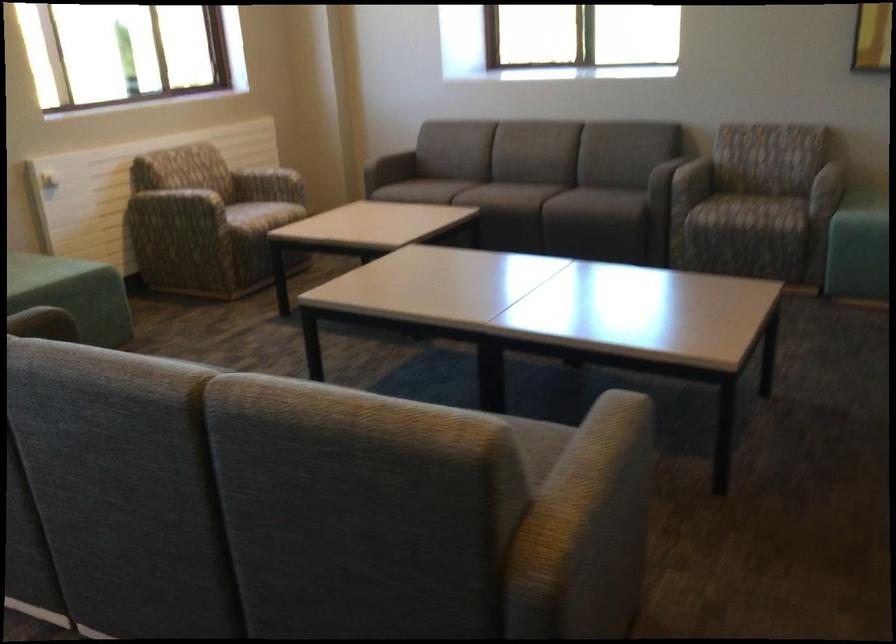
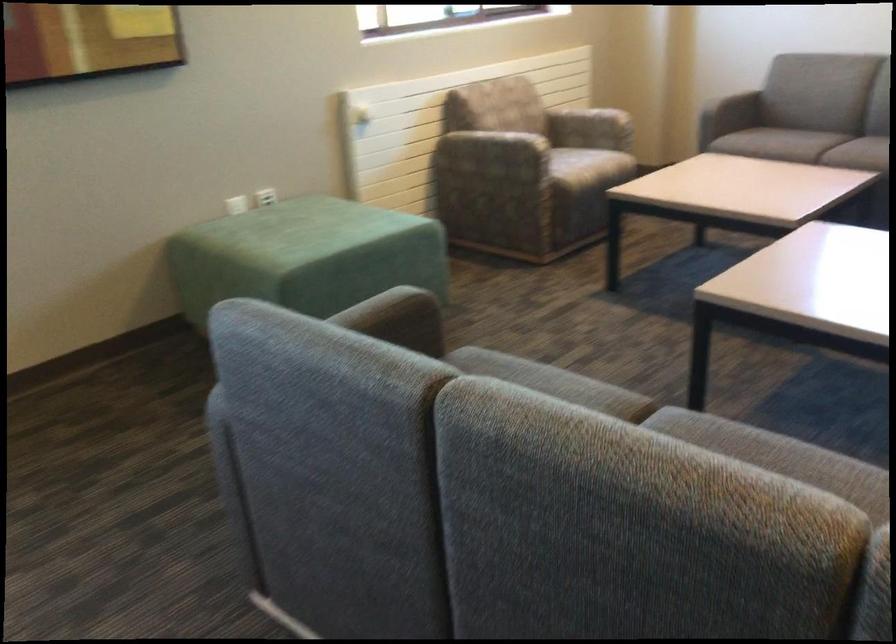
Question: How did the camera likely rotate?

Choices:
 (A) Left
 (B) Right
 (C) Up
 (D) Down

Answer: (A)